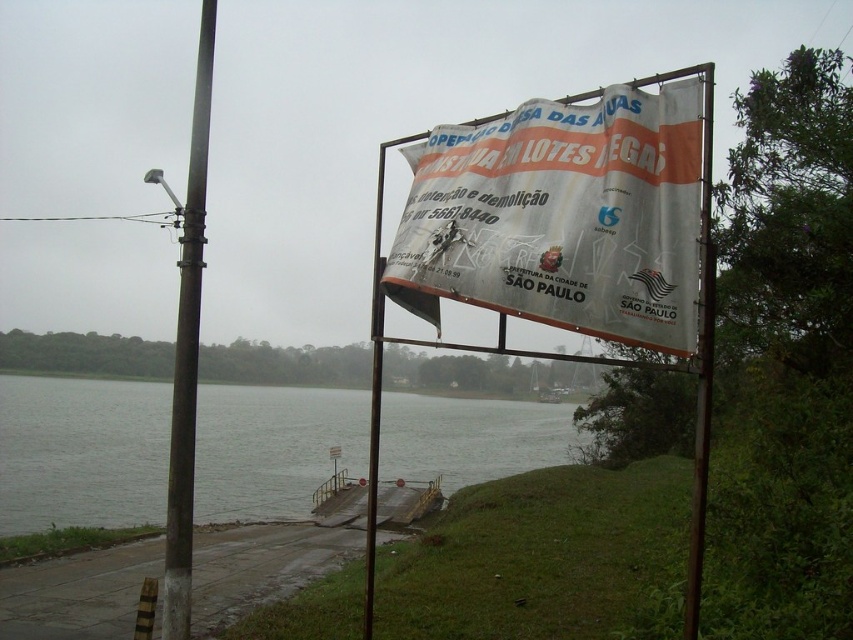
You are a hiker who just arrived at the lakeside. You see the gray water at lower left and the white plastic pole at upper center. Which object is positioned higher in the scene?

The white plastic pole at upper center is positioned higher than the gray water at lower left.

Consider the image. You are a maintenance worker needing to reach the metallic pole at center from the gray water at lower left. Can you walk directly to it without crossing any obstacles? The path is flat and clear.

The distance between the gray water at lower left and the metallic pole at center is 10.31 meters. Since the path is flat and clear, you can walk directly to the metallic pole at center without any obstacles.